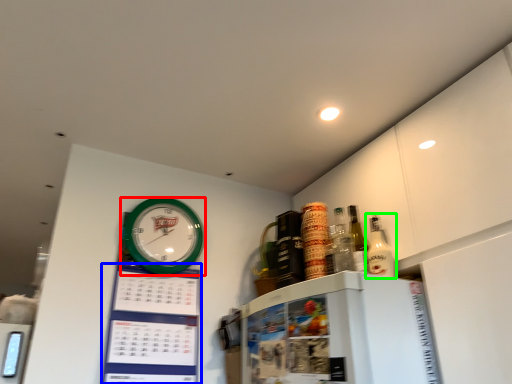
Question: Based on their relative distances, which object is farther from wall clock (highlighted by a red box)? Choose from bulletin board (highlighted by a blue box) and bottle (highlighted by a green box).

Choices:
 (A) bulletin board
 (B) bottle

Answer: (B)